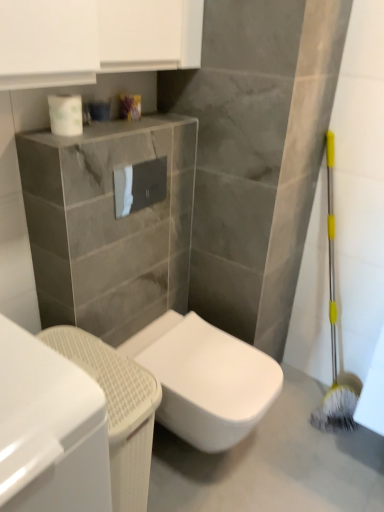
The image size is (384, 512). In order to click on vacant space situated above white glossy toilet at lower left (from a real-world perspective) in this screenshot , I will do `click(98, 365)`.